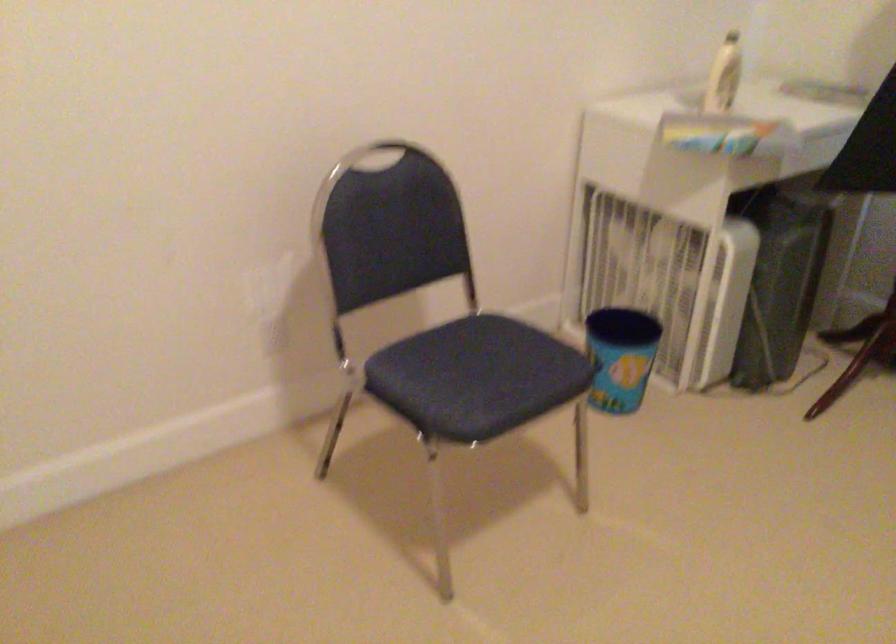
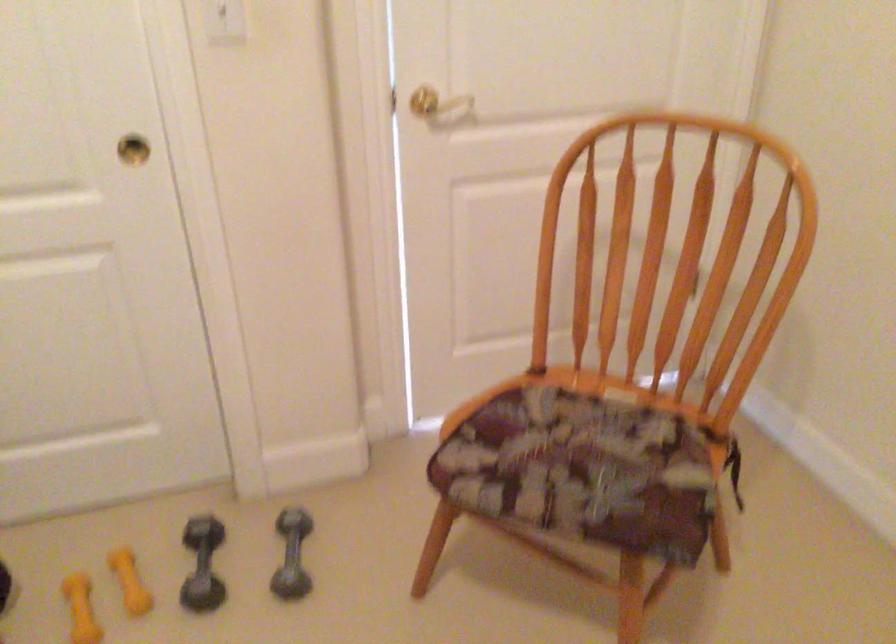
First-person continuous shooting, in which direction is the camera rotating?

The camera rotated toward left-down.